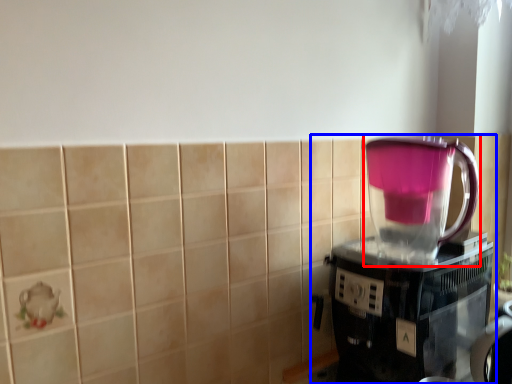
Question: Which object is closer to the camera taking this photo, blender (highlighted by a red box) or coffee maker (highlighted by a blue box)?

Choices:
 (A) blender
 (B) coffee maker

Answer: (B)